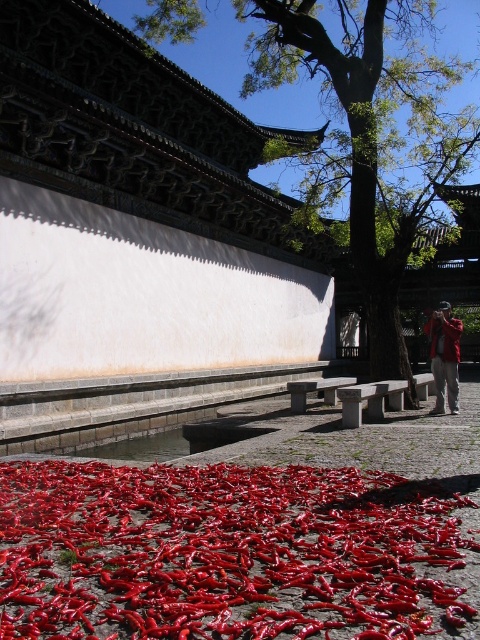
Does red matte pepper at lower center have a lesser width compared to green leafy tree at upper center?

Yes, red matte pepper at lower center is thinner than green leafy tree at upper center.

Between red matte pepper at lower center and green leafy tree at upper center, which one is positioned higher?

green leafy tree at upper center is above.

Which is in front, point (299, 602) or point (330, 74)?

Point (299, 602) is more forward.

This screenshot has height=640, width=480. Identify the location of red matte pepper at lower center. 223,552.

Is the position of green leafy tree at upper center less distant than that of red fabric jacket at lower right?

No, it is not.

Who is more forward, [316,209] or [440,374]?

Point [440,374]

Locate an element on the screen. The width and height of the screenshot is (480, 640). green leafy tree at upper center is located at coordinates [x=369, y=134].

Who is more forward, (x=40, y=509) or (x=444, y=381)?

Result: Point (x=40, y=509) is more forward.

Does point (199, 484) come farther from viewer compared to point (446, 364)?

No, (199, 484) is closer to viewer.

Is point (244, 536) farther from viewer compared to point (434, 406)?

No, it is in front of (434, 406).

What are the coordinates of `red matte pepper at lower center` in the screenshot? It's located at (223, 552).